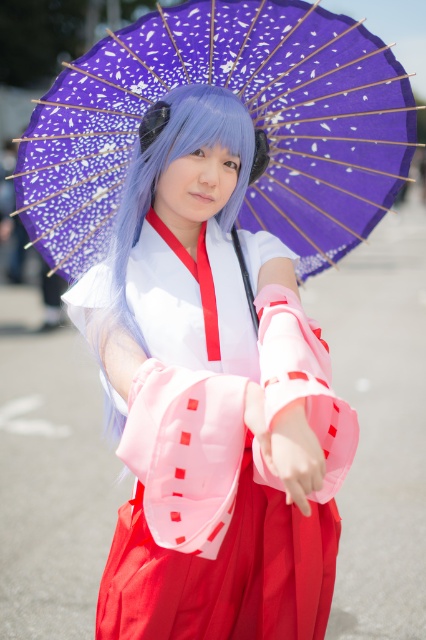
You are a photographer trying to capture the perfect shot of the person in the image. Since the purple paper umbrella at upper center and the matte pink kimono at center are both important elements, which one should you position closer to the left side of the frame to ensure both are visible?

The purple paper umbrella at upper center should be positioned closer to the left side of the frame because the matte pink kimono at center is already to the right of it, so moving the umbrella left would keep both elements within the frame without overlapping.

You are a fashion designer who wants to place a decorative pin on the matte pink kimono at center. According to the coordinates provided, where should you place the pin to ensure it is centered on the kimono?

The matte pink kimono at center is positioned at coordinates point (212, 401), so placing the pin at these coordinates would center it on the kimono.

You are an artist trying to sketch the scene. You need to decide the order to draw the objects based on their height. Which object should you draw first, the matte pink kimono at center or the purple paper umbrella at upper center?

The matte pink kimono at center is taller than the purple paper umbrella at upper center, so you should draw the matte pink kimono at center first.